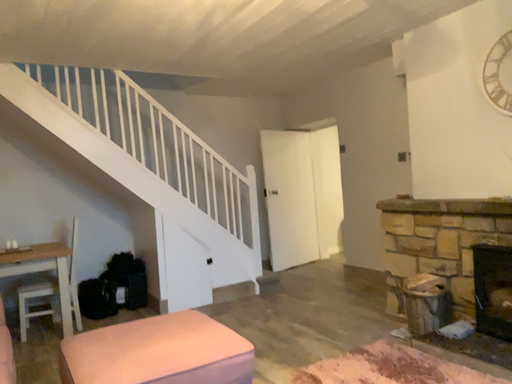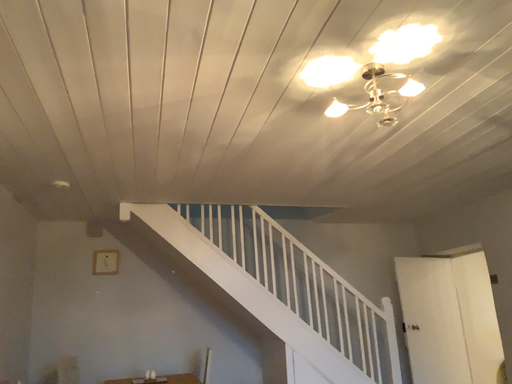
Question: How did the camera likely rotate when shooting the video?

Choices:
 (A) rotated downward
 (B) rotated upward

Answer: (B)